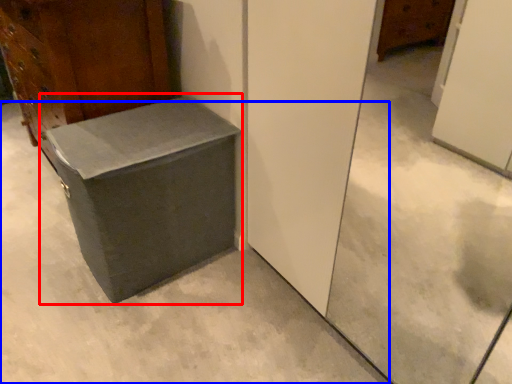
Question: Among these objects, which one is nearest to the camera, cardboard box (highlighted by a red box) or concrete (highlighted by a blue box)?

Choices:
 (A) cardboard box
 (B) concrete

Answer: (B)